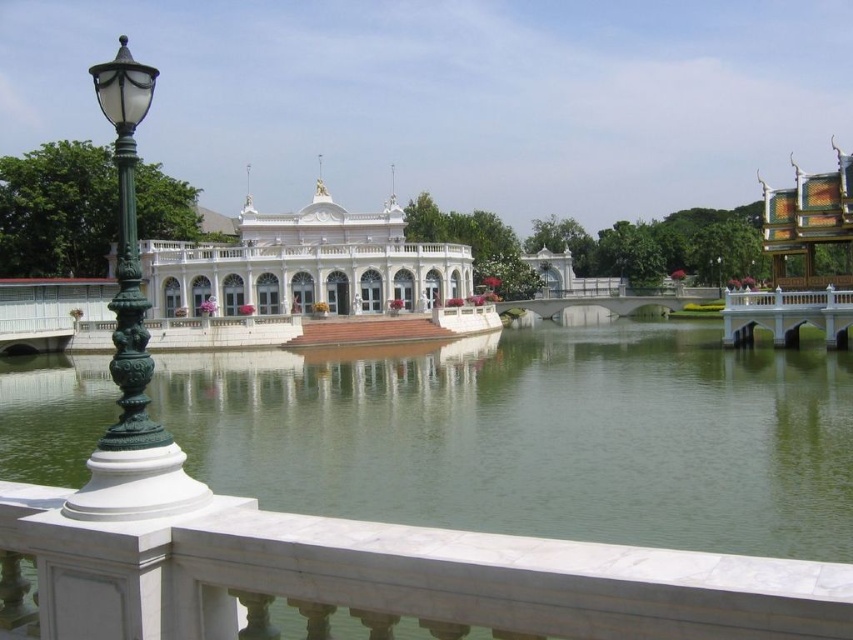
Is green water at center smaller than white marble palace at center?

Actually, green water at center might be larger than white marble palace at center.

Is point (416, 506) positioned in front of point (260, 273)?

Yes, it is.

This screenshot has width=853, height=640. I want to click on green water at center, so click(x=537, y=435).

Where is `green water at center`? green water at center is located at coordinates [x=537, y=435].

Who is lower down, green water at center or green ornate metal lamp post at left?

Positioned lower is green water at center.

Does green water at center appear under green ornate metal lamp post at left?

Yes, green water at center is below green ornate metal lamp post at left.

Which is behind, point (834, 412) or point (134, 300)?

Positioned behind is point (834, 412).

This screenshot has width=853, height=640. Identify the location of green water at center. (537, 435).

Is white marble palace at center above green ornate metal lamp post at left?

No, white marble palace at center is not above green ornate metal lamp post at left.

Which is behind, point (390, 236) or point (120, 406)?

The point (390, 236) is behind.

I want to click on white marble palace at center, so point(306,264).